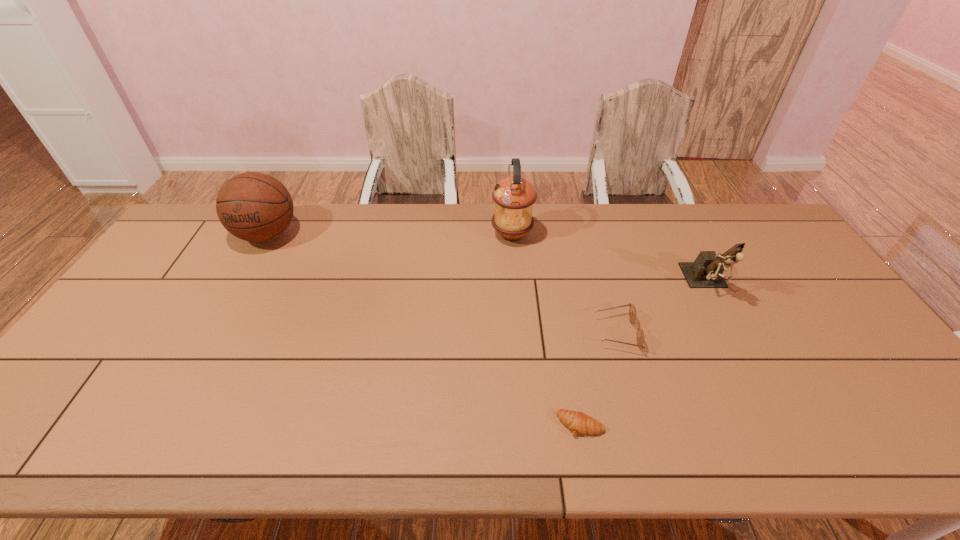
At what (x,y) coordinates should I click in order to perform the action: click on free space that satisfies the following two spatial constraints: 1. on the side with brand label of the oil lamp; 2. on the left side of the basketball. Please return your answer as a coordinate pair (x, y). Looking at the image, I should click on (267, 235).

The width and height of the screenshot is (960, 540). I want to click on vacant region that satisfies the following two spatial constraints: 1. on the front side of the shortest object; 2. on the right side of the tallest object, so click(528, 424).